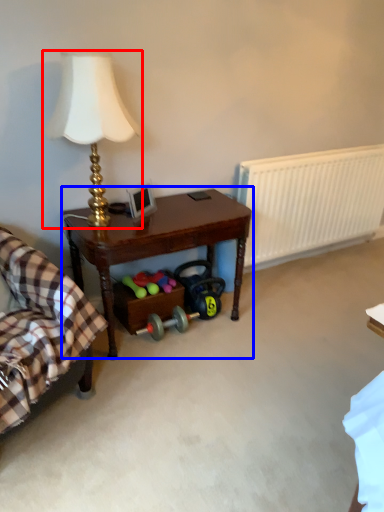
Question: Which point is further to the camera, lamp (highlighted by a red box) or table (highlighted by a blue box)?

Choices:
 (A) lamp
 (B) table

Answer: (B)